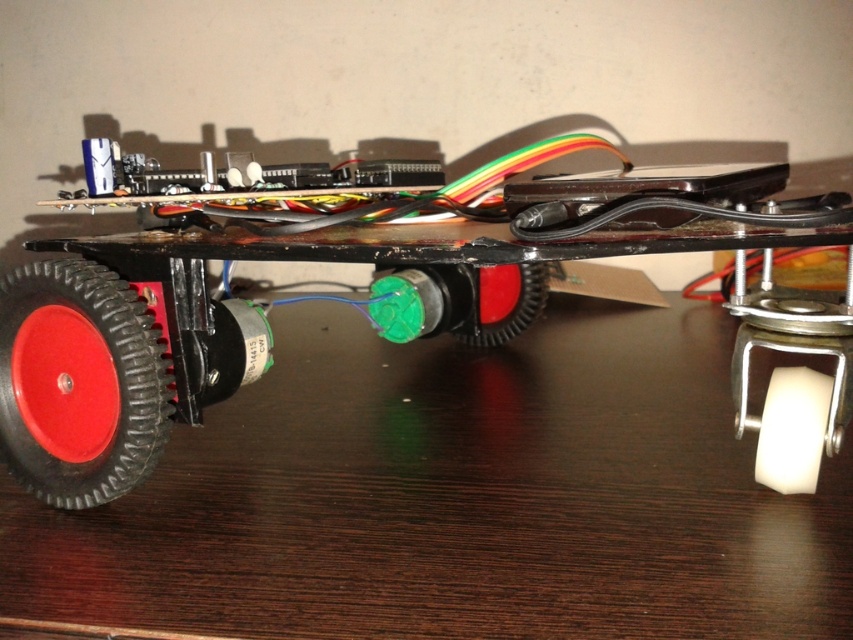
Is point (106, 392) less distant than point (476, 285)?

Yes.

Is point (30, 413) closer to camera compared to point (509, 336)?

Yes, it is.

I want to click on rubber/textured wheel at lower left, so click(79, 381).

From the picture: Measure the distance between point (64, 362) and camera.

A distance of 24.35 inches exists between point (64, 362) and camera.

Between rubberized black toy car at left and rubber/textured wheel at center, which one is positioned higher?

Positioned higher is rubberized black toy car at left.

Find the location of a particular element. The image size is (853, 640). rubberized black toy car at left is located at coordinates (381, 296).

Does rubberized black toy car at left have a larger size compared to rubber/textured wheel at lower left?

Correct, rubberized black toy car at left is larger in size than rubber/textured wheel at lower left.

I want to click on rubberized black toy car at left, so click(381, 296).

Where is `rubberized black toy car at left`? The width and height of the screenshot is (853, 640). rubberized black toy car at left is located at coordinates (381, 296).